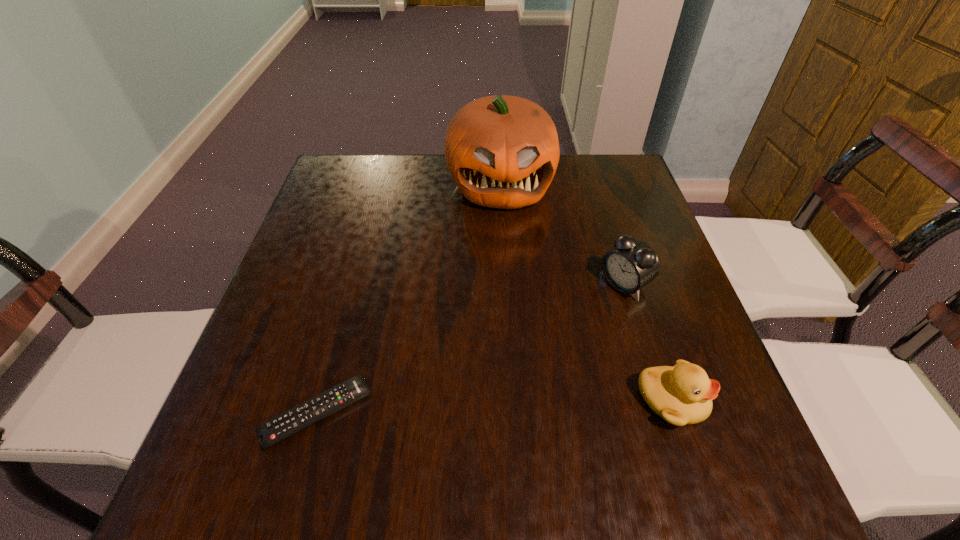
Identify the location of vacant space on the desktop that is between the shortest object and the second shortest object and is positioned on the front side of the second tallest object. The image size is (960, 540). (460, 408).

In order to click on free space on the desktop that is between the shortest object and the duckling and is positioned on the face of the farthest object in this screenshot , I will do `click(526, 406)`.